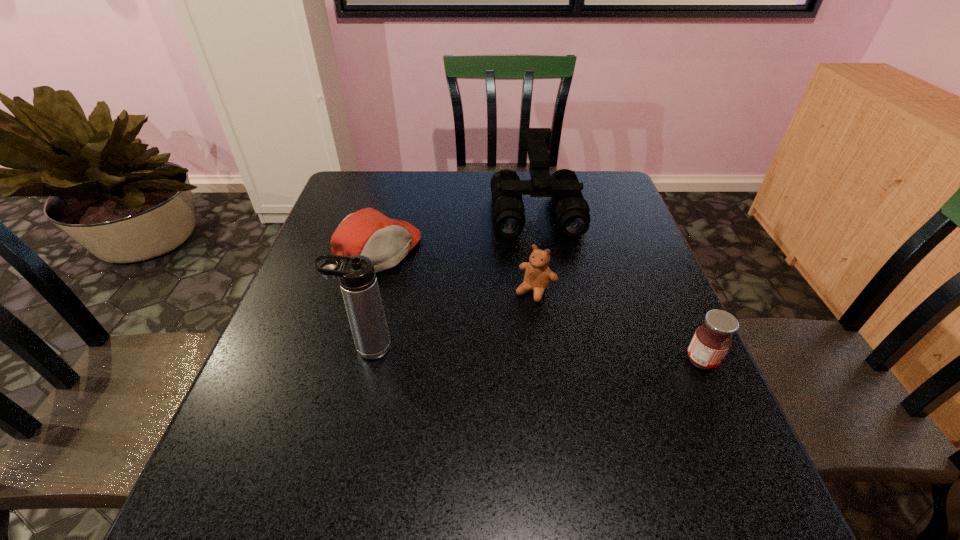
I want to click on vacant spot on the desktop that is between the tallest object and the rightmost object and is positioned on the front-facing side of the cap, so click(557, 355).

This screenshot has width=960, height=540. What are the coordinates of `free spot on the desktop that is between the thermos bottle and the rightmost object and is positioned on the front lenses of the second tallest object` in the screenshot? It's located at (563, 355).

Locate an element on the screen. The height and width of the screenshot is (540, 960). free spot on the desktop that is between the tallest object and the jam and is positioned on the face of the teddy bear is located at coordinates (492, 353).